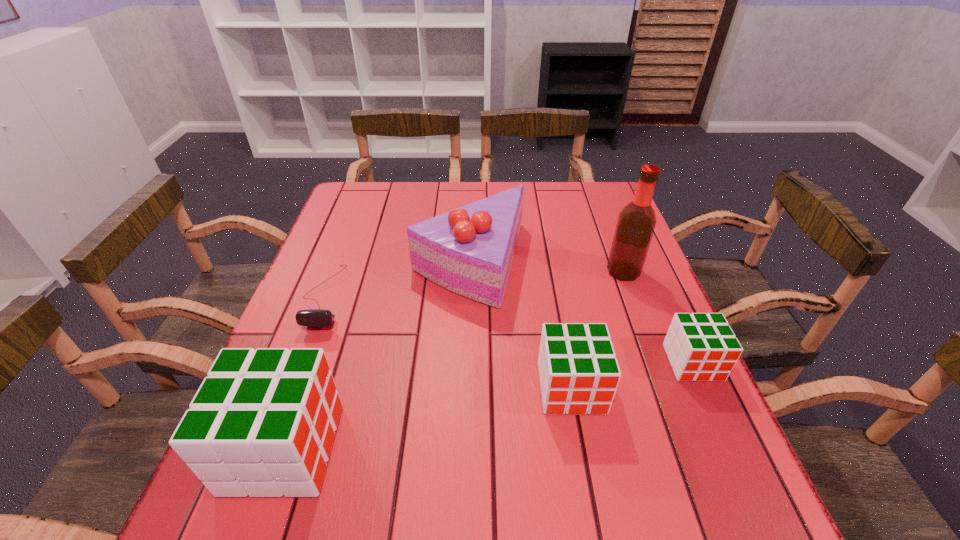
The width and height of the screenshot is (960, 540). What are the coordinates of `the tallest cube` in the screenshot? It's located at (263, 422).

Where is `the second cube from right to left`? This screenshot has height=540, width=960. the second cube from right to left is located at coordinates (579, 373).

This screenshot has height=540, width=960. I want to click on the second tallest cube, so click(x=579, y=373).

This screenshot has height=540, width=960. Identify the location of the shortest cube. (702, 347).

Where is `the rightmost cube`? The height and width of the screenshot is (540, 960). the rightmost cube is located at coordinates (702, 347).

Locate an element on the screen. The width and height of the screenshot is (960, 540). cake is located at coordinates (469, 251).

The width and height of the screenshot is (960, 540). I want to click on beer bottle, so click(636, 222).

This screenshot has height=540, width=960. I want to click on webcam, so click(x=312, y=317).

I want to click on free point located 0.330m on the red face of the leftmost cube, so click(516, 448).

Where is `vacant space located 0.100m on the red face of the second shortest cube`? Image resolution: width=960 pixels, height=540 pixels. vacant space located 0.100m on the red face of the second shortest cube is located at coordinates (586, 467).